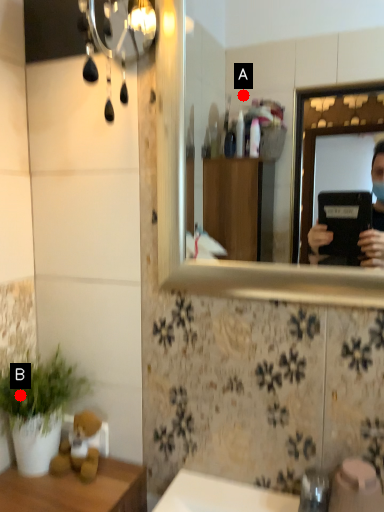
Question: Two points are circled on the image, labeled by A and B beside each circle. Among these points, which one is nearest to the camera?

Choices:
 (A) A is closer
 (B) B is closer

Answer: (B)